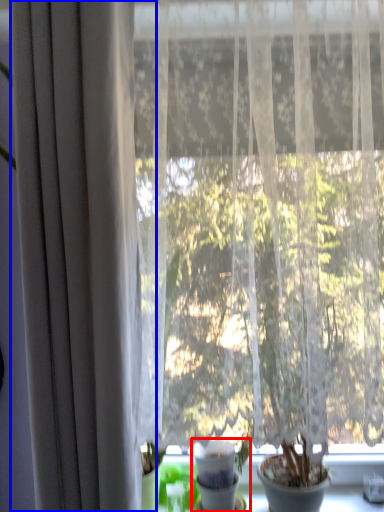
Question: Which object appears closest to the camera in this image, houseplant (highlighted by a red box) or curtain (highlighted by a blue box)?

Choices:
 (A) houseplant
 (B) curtain

Answer: (B)